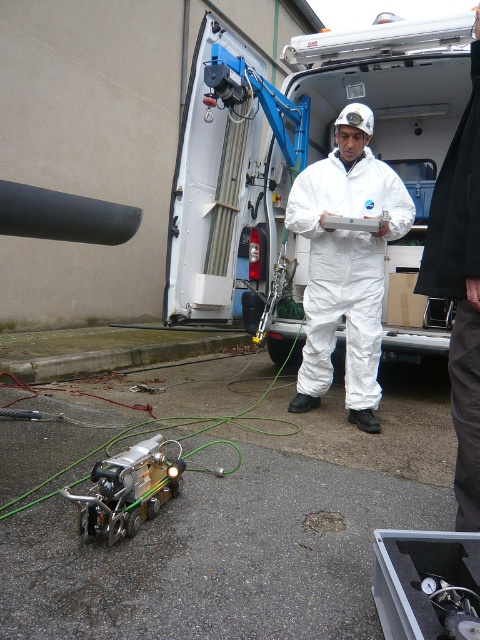
Who is higher up, white matte suit at center or metallic/brass-like robot at lower left?

white matte suit at center

Does white matte suit at center have a greater width compared to metallic/brass-like robot at lower left?

Indeed, white matte suit at center has a greater width compared to metallic/brass-like robot at lower left.

Who is more forward, (342, 145) or (155, 465)?

Point (155, 465) is more forward.

The image size is (480, 640). What are the coordinates of `white matte suit at center` in the screenshot? It's located at (346, 262).